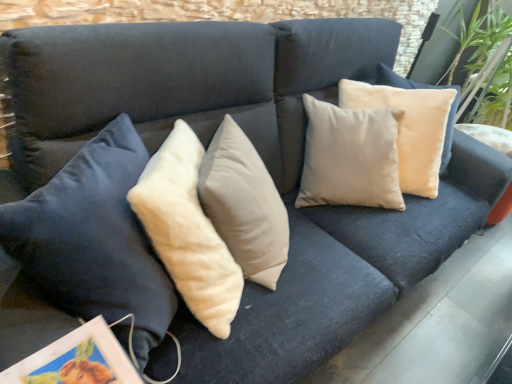
The height and width of the screenshot is (384, 512). What are the coordinates of `matte white picture frame at lower left` in the screenshot? It's located at (77, 360).

What do you see at coordinates (77, 360) in the screenshot? The image size is (512, 384). I see `matte white picture frame at lower left` at bounding box center [77, 360].

What is the approximate height of green velvety plant at upper right?

It is 36.26 inches.

Image resolution: width=512 pixels, height=384 pixels. Find the location of `green velvety plant at upper right`. green velvety plant at upper right is located at coordinates (484, 78).

Measure the distance between point (492, 57) and camera.

Point (492, 57) is 9.41 feet away from camera.

Describe the element at coordinates (484, 78) in the screenshot. The width and height of the screenshot is (512, 384). I see `green velvety plant at upper right` at that location.

Where is `matte white picture frame at lower left`? matte white picture frame at lower left is located at coordinates 77,360.

Which object is positioned more to the right, green velvety plant at upper right or matte white picture frame at lower left?

green velvety plant at upper right.

Considering the positions of objects green velvety plant at upper right and matte white picture frame at lower left in the image provided, who is behind, green velvety plant at upper right or matte white picture frame at lower left?

green velvety plant at upper right is further from the camera.

Is point (505, 114) closer or farther from the camera than point (26, 362)?

Point (505, 114) appears to be farther away from the viewer than point (26, 362).

From the image's perspective, which is above, green velvety plant at upper right or matte white picture frame at lower left?

From the image's view, green velvety plant at upper right is above.

From a real-world perspective, is green velvety plant at upper right on matte white picture frame at lower left?

Yes.

Which object is wider, green velvety plant at upper right or matte white picture frame at lower left?

With larger width is green velvety plant at upper right.

Which of these two, green velvety plant at upper right or matte white picture frame at lower left, stands taller?

With more height is green velvety plant at upper right.

Who is bigger, green velvety plant at upper right or matte white picture frame at lower left?

green velvety plant at upper right is bigger.

Is green velvety plant at upper right located outside matte white picture frame at lower left?

green velvety plant at upper right is positioned outside matte white picture frame at lower left.

Is the surface of green velvety plant at upper right in direct contact with matte white picture frame at lower left?

No.

Is green velvety plant at upper right facing towards matte white picture frame at lower left?

No, green velvety plant at upper right is not turned towards matte white picture frame at lower left.

At what (x,y) coordinates should I click in order to perform the action: click on plant behind the matte white picture frame at lower left. Please return your answer as a coordinate pair (x, y). This screenshot has width=512, height=384. Looking at the image, I should click on click(x=484, y=78).

Which object is positioned more to the left, matte white picture frame at lower left or green velvety plant at upper right?

matte white picture frame at lower left is more to the left.

Which object is more forward, matte white picture frame at lower left or green velvety plant at upper right?

matte white picture frame at lower left is more forward.

Is point (104, 348) farther from viewer compared to point (462, 96)?

That is False.

From the image's perspective, is matte white picture frame at lower left under green velvety plant at upper right?

Yes.

From a real-world perspective, who is located lower, matte white picture frame at lower left or green velvety plant at upper right?

matte white picture frame at lower left is physically lower.

Does matte white picture frame at lower left have a lesser width compared to green velvety plant at upper right?

Yes.

Is matte white picture frame at lower left shorter than green velvety plant at upper right?

Yes.

Considering the sizes of objects matte white picture frame at lower left and green velvety plant at upper right in the image provided, who is bigger, matte white picture frame at lower left or green velvety plant at upper right?

Bigger between the two is green velvety plant at upper right.

Is green velvety plant at upper right surrounded by matte white picture frame at lower left?

That's incorrect, green velvety plant at upper right is not inside matte white picture frame at lower left.

Would you consider matte white picture frame at lower left to be distant from green velvety plant at upper right?

Yes.

Could you tell me if matte white picture frame at lower left is turned towards green velvety plant at upper right?

No, matte white picture frame at lower left is not facing towards green velvety plant at upper right.

Can you tell me how much matte white picture frame at lower left and green velvety plant at upper right differ in facing direction?

The angle between the facing direction of matte white picture frame at lower left and the facing direction of green velvety plant at upper right is 39.2 degrees.

The height and width of the screenshot is (384, 512). Find the location of `plant above the matte white picture frame at lower left (from the image's perspective)`. plant above the matte white picture frame at lower left (from the image's perspective) is located at coordinates (484, 78).

Where is `plant that is above the matte white picture frame at lower left (from the image's perspective)`? Image resolution: width=512 pixels, height=384 pixels. plant that is above the matte white picture frame at lower left (from the image's perspective) is located at coordinates (484, 78).

Find the location of a particular element. The width and height of the screenshot is (512, 384). picture frame below the green velvety plant at upper right (from the image's perspective) is located at coordinates (77, 360).